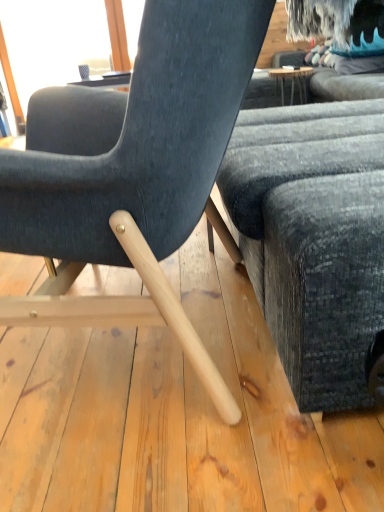
Question: Is dark gray fabric couch at right inside the boundaries of velvet dark blue chair at center, or outside?

Choices:
 (A) outside
 (B) inside

Answer: (A)

Question: Considering their positions, is dark gray fabric couch at right located in front of or behind velvet dark blue chair at center?

Choices:
 (A) behind
 (B) front

Answer: (A)

Question: Looking at the image, does dark gray fabric couch at right seem bigger or smaller compared to velvet dark blue chair at center?

Choices:
 (A) small
 (B) big

Answer: (B)

Question: Is velvet dark blue chair at center wider or thinner than dark gray fabric couch at right?

Choices:
 (A) wide
 (B) thin

Answer: (A)

Question: Is velvet dark blue chair at center spatially inside dark gray fabric couch at right, or outside of it?

Choices:
 (A) outside
 (B) inside

Answer: (A)

Question: Considering the relative positions of velvet dark blue chair at center and dark gray fabric couch at right in the image provided, is velvet dark blue chair at center to the left or to the right of dark gray fabric couch at right?

Choices:
 (A) left
 (B) right

Answer: (A)

Question: From the image's perspective, relative to dark gray fabric couch at right, is velvet dark blue chair at center above or below?

Choices:
 (A) above
 (B) below

Answer: (B)